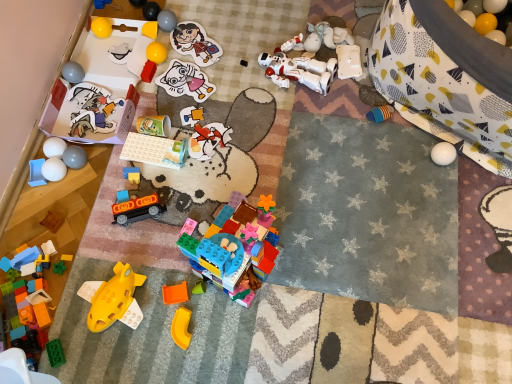
This screenshot has width=512, height=384. I want to click on vacant area that lies between white matte robot at upper center, positioned as the 23th toy in left-to-right order, and matte gray ball at upper center, arranged as the eighth toy when viewed from the right, so pyautogui.click(x=222, y=49).